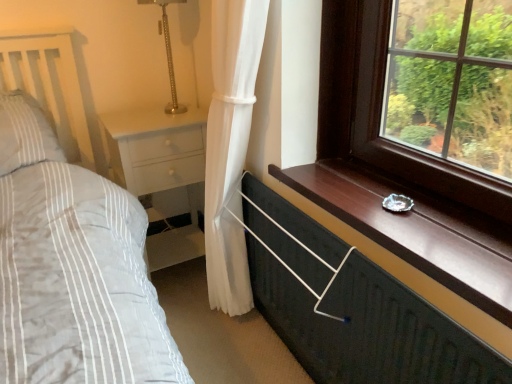
Question: Is white glossy nightstand at lower left at the left side of gold textured table lamp at upper center?

Choices:
 (A) no
 (B) yes

Answer: (B)

Question: Considering the relative sizes of white glossy nightstand at lower left and gold textured table lamp at upper center in the image provided, is white glossy nightstand at lower left bigger than gold textured table lamp at upper center?

Choices:
 (A) no
 (B) yes

Answer: (B)

Question: Does white glossy nightstand at lower left come in front of gold textured table lamp at upper center?

Choices:
 (A) yes
 (B) no

Answer: (B)

Question: Does white glossy nightstand at lower left have a greater height compared to gold textured table lamp at upper center?

Choices:
 (A) yes
 (B) no

Answer: (A)

Question: Could you tell me if white glossy nightstand at lower left is facing gold textured table lamp at upper center?

Choices:
 (A) no
 (B) yes

Answer: (A)

Question: Is white glossy nightstand at lower left oriented away from gold textured table lamp at upper center?

Choices:
 (A) yes
 (B) no

Answer: (B)

Question: Is white glossy nightstand at lower left a part of gold textured table lamp at upper center?

Choices:
 (A) no
 (B) yes

Answer: (A)

Question: Is gold textured table lamp at upper center in front of white glossy nightstand at lower left?

Choices:
 (A) no
 (B) yes

Answer: (B)

Question: From a real-world perspective, is gold textured table lamp at upper center under white glossy nightstand at lower left?

Choices:
 (A) yes
 (B) no

Answer: (B)

Question: Is gold textured table lamp at upper center further to camera compared to white glossy nightstand at lower left?

Choices:
 (A) yes
 (B) no

Answer: (B)

Question: Is there a large distance between gold textured table lamp at upper center and white glossy nightstand at lower left?

Choices:
 (A) yes
 (B) no

Answer: (B)

Question: Is gold textured table lamp at upper center not inside white glossy nightstand at lower left?

Choices:
 (A) yes
 (B) no

Answer: (A)

Question: From a real-world perspective, is white glossy nightstand at lower left on top of metallic dark green chest of drawers at lower right?

Choices:
 (A) yes
 (B) no

Answer: (A)